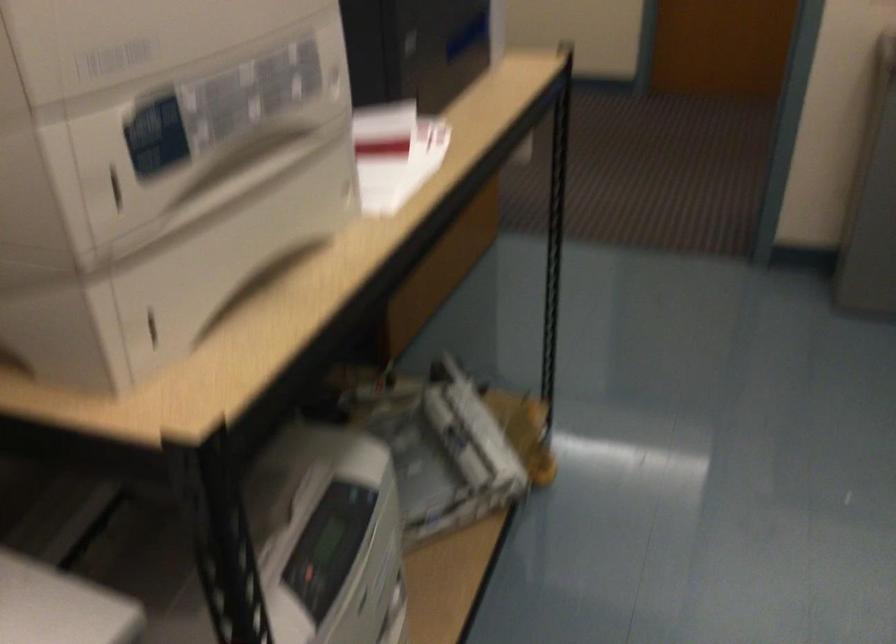
Where is `printer tray handle`? This screenshot has width=896, height=644. printer tray handle is located at coordinates (116, 189).